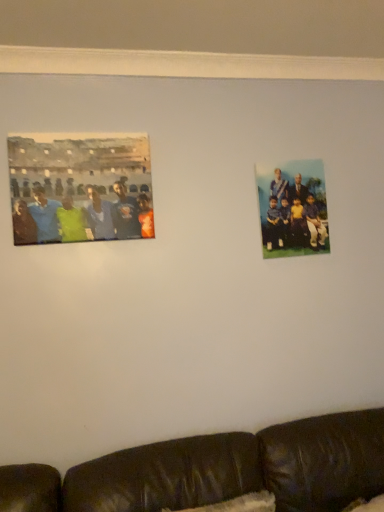
Question: In the image, is blue fabric group at upper right, the second person when ordered from left to right, positioned in front of or behind matte green shirt at left, the first person in the front-to-back sequence?

Choices:
 (A) front
 (B) behind

Answer: (B)

Question: Is point (281, 186) positioned closer to the camera than point (74, 228)?

Choices:
 (A) closer
 (B) farther

Answer: (B)

Question: Which of these objects is positioned farthest from the blue fabric group at upper right, which is the second person in front-to-back order?

Choices:
 (A) black leather couch at lower center
 (B) matte green shirt at left, placed as the 1th person when sorted from left to right

Answer: (A)

Question: Based on their relative distances, which object is nearer to the matte green shirt at left, the first person in the front-to-back sequence?

Choices:
 (A) black leather couch at lower center
 (B) blue fabric group at upper right, which is the 1th person in back-to-front order

Answer: (B)